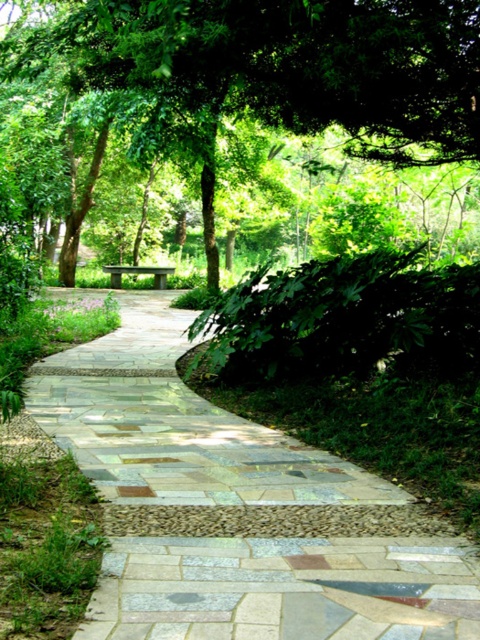
You are standing at the starting point of the garden pathway and see two points marked in the scene. The first point is labeled as point (404,515) and the second point is labeled as point (432,140). Which of these two points is closer to you as you face the pathway?

Point (404,515) is closer to you because it is in front of point (432,140).

You are standing at the entrance of the garden and see the natural stone pathway at center and the green stone bench at center. Which object is closer to you?

The natural stone pathway at center is closer to you than the green stone bench at center because it is in front of it.

You are designing a garden layout and need to place a new decorative fountain. The natural stone pathway at center and the green stone bench at center are already in place. Which object should you consider moving if space is limited, and why?

The green stone bench at center should be considered for moving because it is smaller in size than the natural stone pathway at center, making it easier to relocate without disrupting the main path.